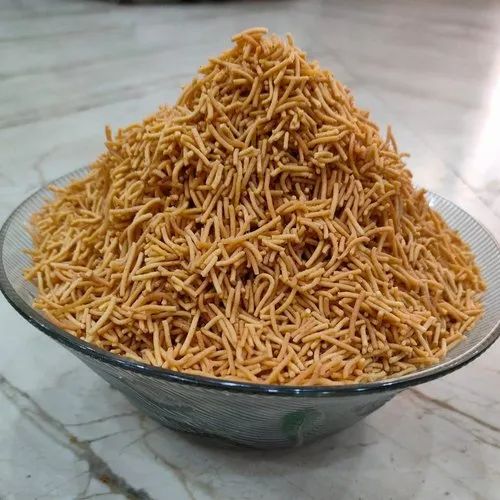
In order to click on left edge of bowl in this screenshot , I will do `click(6, 282)`.